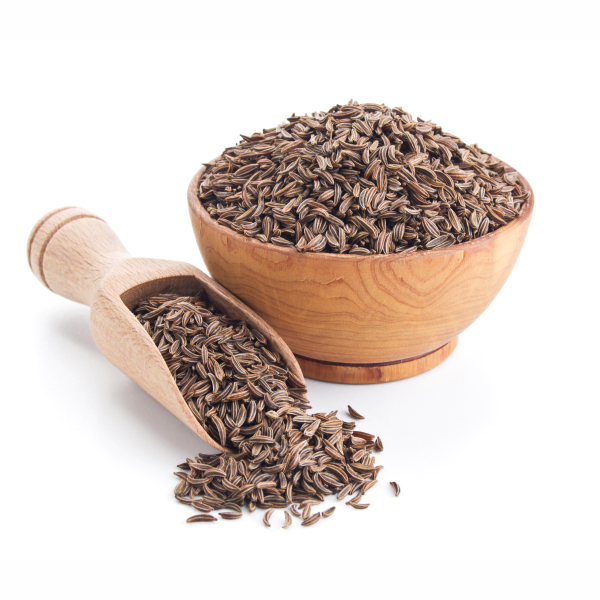
Locate an element on the screen. This screenshot has width=600, height=600. seeds in bowl is located at coordinates (387, 171).